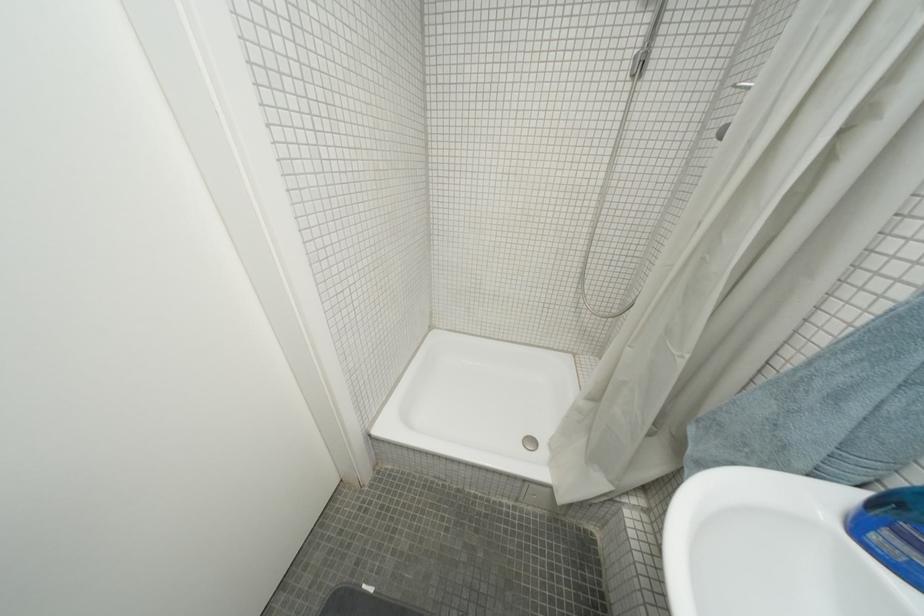
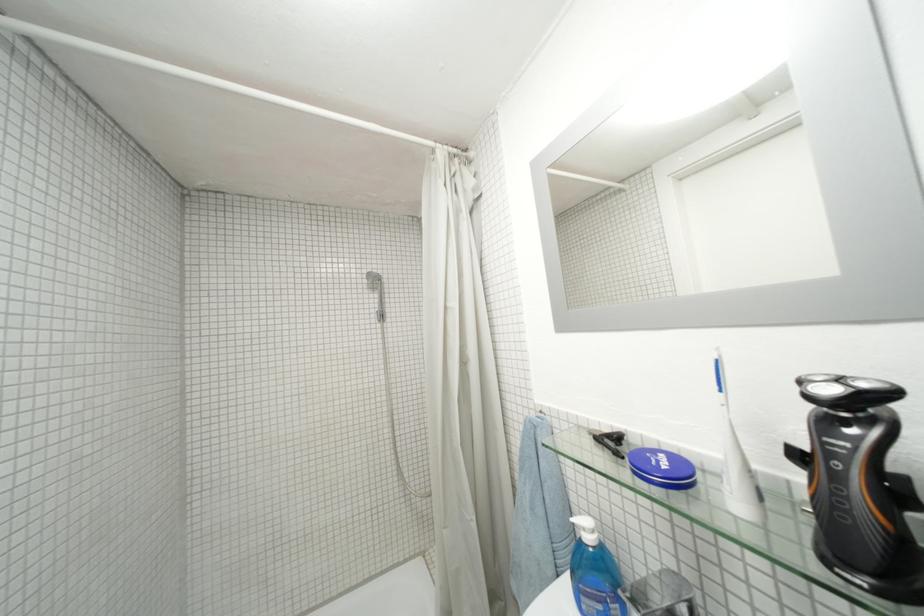
Find the pixel in the second image that matches (697,359) in the first image.

(482, 521)